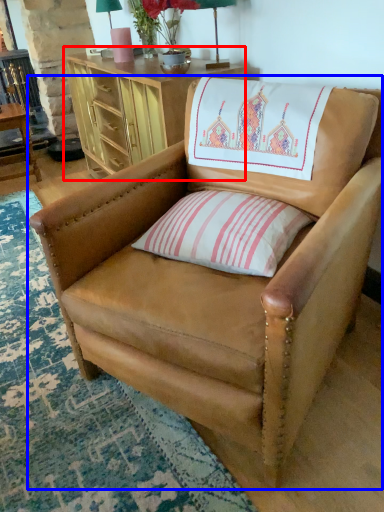
Question: Which object appears farthest to the camera in this image, desk (highlighted by a red box) or chair (highlighted by a blue box)?

Choices:
 (A) desk
 (B) chair

Answer: (A)